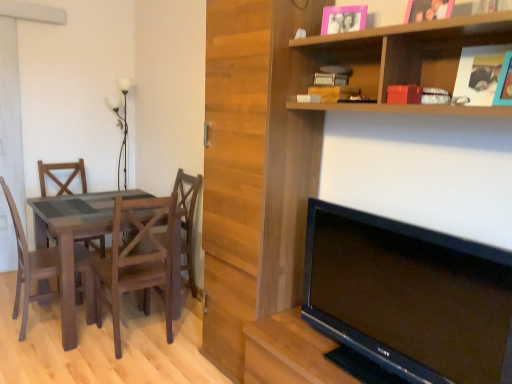
Where is `free location to the right of pink matte picture frame at upper center, which is counted as the second picture frame, starting from the left`? This screenshot has width=512, height=384. free location to the right of pink matte picture frame at upper center, which is counted as the second picture frame, starting from the left is located at coordinates (462, 28).